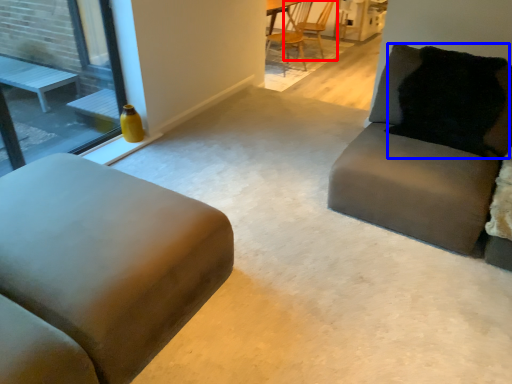
Question: Which object is further to the camera taking this photo, chair (highlighted by a red box) or pillow (highlighted by a blue box)?

Choices:
 (A) chair
 (B) pillow

Answer: (A)